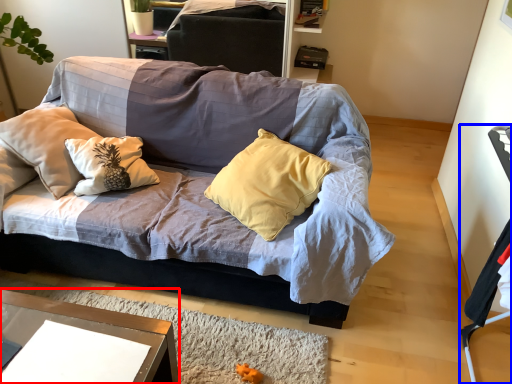
Question: Among these objects, which one is nearest to the camera, desk (highlighted by a red box) or armchair (highlighted by a blue box)?

Choices:
 (A) desk
 (B) armchair

Answer: (A)